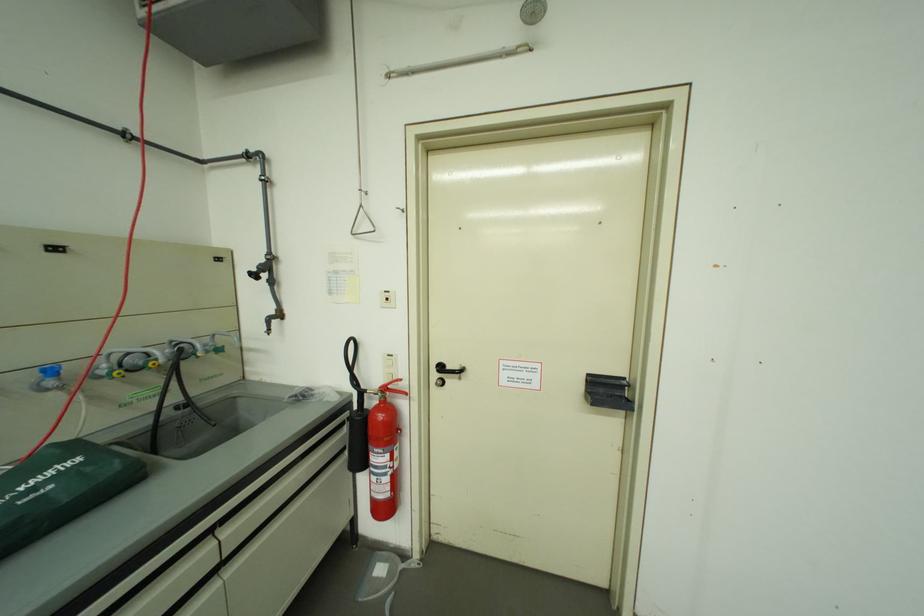
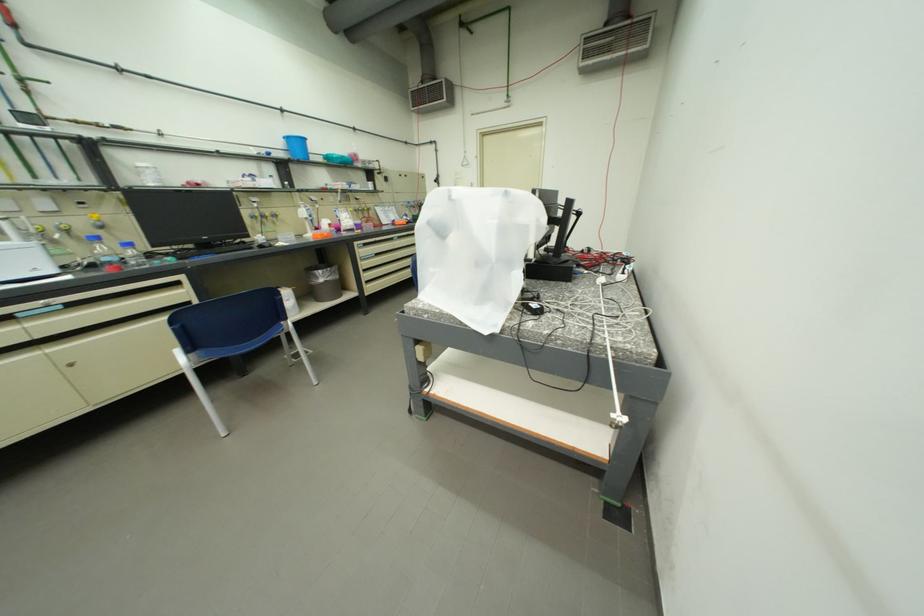
Question: The images are taken continuously from a first-person perspective. In which direction are you moving?

Choices:
 (A) Left
 (B) Right
 (C) Forward
 (D) Backward

Answer: (D)